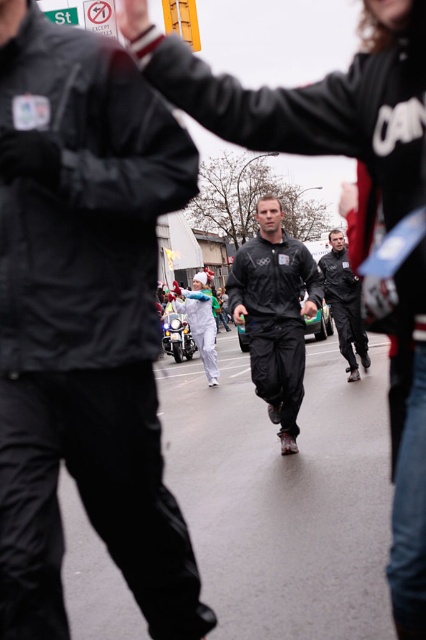
Between point (42, 513) and point (268, 232), which one is positioned behind?

The point (268, 232) is behind.

Can you confirm if black matte suit at center is bigger than matte black tracksuit at center?

Actually, black matte suit at center might be smaller than matte black tracksuit at center.

Does point (94, 244) come in front of point (270, 326)?

Yes, point (94, 244) is closer to viewer.

Locate an element on the screen. The height and width of the screenshot is (640, 426). black matte suit at center is located at coordinates (85, 323).

Can you confirm if black matte suit at center is positioned to the left of black matte jacket at center?

Correct, you'll find black matte suit at center to the left of black matte jacket at center.

Does black matte suit at center have a greater height compared to black matte jacket at center?

Indeed, black matte suit at center has a greater height compared to black matte jacket at center.

Locate an element on the screen. The width and height of the screenshot is (426, 640). black matte suit at center is located at coordinates 85,323.

Does matte black tracksuit at center have a lesser width compared to black matte jacket at center?

Incorrect, matte black tracksuit at center's width is not less than black matte jacket at center's.

Does matte black tracksuit at center lie behind black matte jacket at center?

No, matte black tracksuit at center is in front of black matte jacket at center.

Is point (281, 284) more distant than point (348, 339)?

No, (281, 284) is closer to viewer.

Locate an element on the screen. Image resolution: width=426 pixels, height=640 pixels. matte black tracksuit at center is located at coordinates [275, 314].